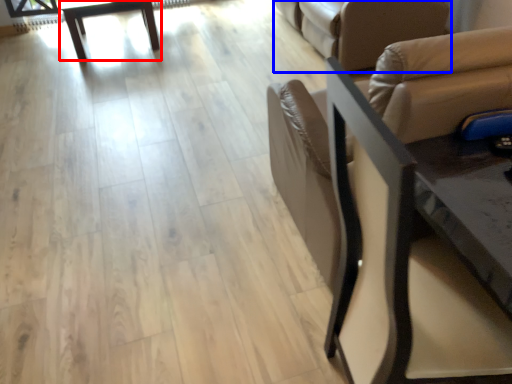
Question: Which of the following is the farthest to the observer, table (highlighted by a red box) or futon (highlighted by a blue box)?

Choices:
 (A) table
 (B) futon

Answer: (A)